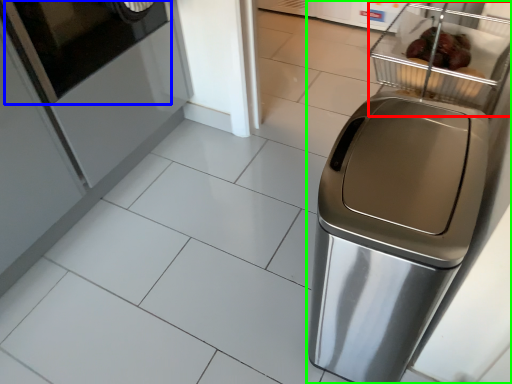
Question: Based on their relative distances, which object is farther from basket (highlighted by a red box)? Choose from screen door (highlighted by a blue box) and home appliance (highlighted by a green box).

Choices:
 (A) screen door
 (B) home appliance

Answer: (A)